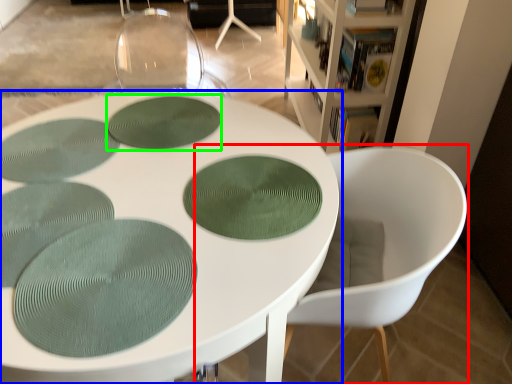
Question: Estimate the real-world distances between objects in this image. Which object is farther from chair (highlighted by a red box), table (highlighted by a blue box) or oval (highlighted by a green box)?

Choices:
 (A) table
 (B) oval

Answer: (B)